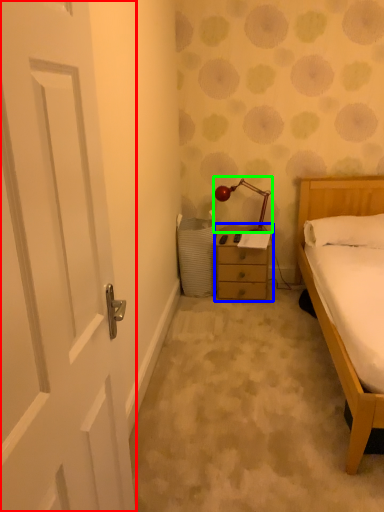
Question: Considering the real-world distances, which object is farthest from door (highlighted by a red box)? nightstand (highlighted by a blue box) or lamp (highlighted by a green box)?

Choices:
 (A) nightstand
 (B) lamp

Answer: (B)